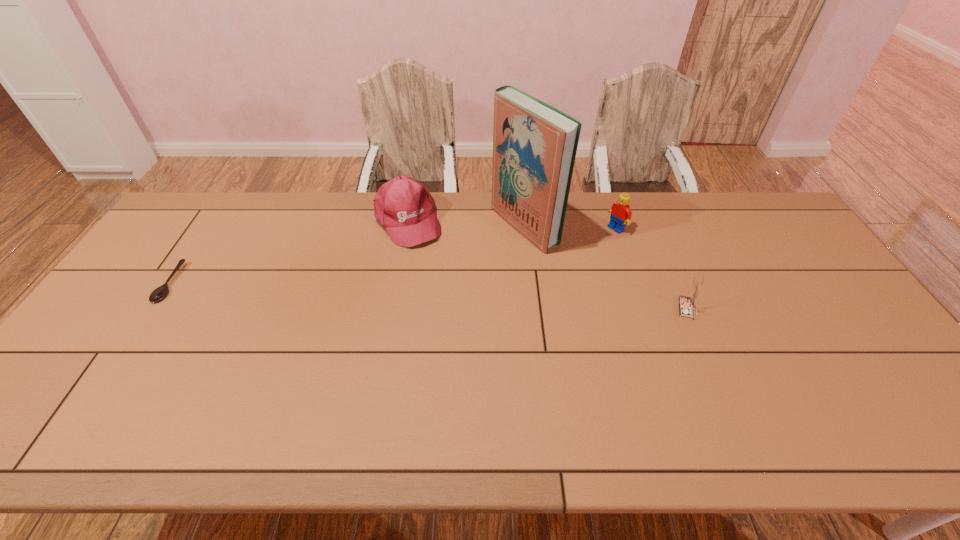
Locate an element on the screen. soupspoon is located at coordinates (160, 292).

Identify the location of the shortest object. This screenshot has height=540, width=960. (160, 292).

Where is `matchbox`? matchbox is located at coordinates (686, 304).

You are a GUI agent. You are given a task and a screenshot of the screen. Output one action in this format:
    pyautogui.click(x=<x>, y=<y>)
    Task: Click on the second object from left to right
    This screenshot has width=960, height=540.
    Given the screenshot: What is the action you would take?
    pyautogui.click(x=404, y=207)

Identify the location of hardback book. (534, 144).

At what (x,y) coordinates should I click in order to perform the action: click on the third object from right to left. Please return your answer as a coordinate pair (x, y). This screenshot has height=540, width=960. Looking at the image, I should click on (534, 144).

Locate an element on the screen. This screenshot has height=540, width=960. Lego is located at coordinates (620, 214).

Find the location of `vacant space located on the right of the leftmost object`. vacant space located on the right of the leftmost object is located at coordinates (201, 283).

Locate an element on the screen. Image resolution: width=960 pixels, height=540 pixels. free point located on the front of the matchbox is located at coordinates (722, 393).

Identify the location of free space located 0.120m at the front of the fourth object from right to left with the brim. This screenshot has height=540, width=960. (434, 271).